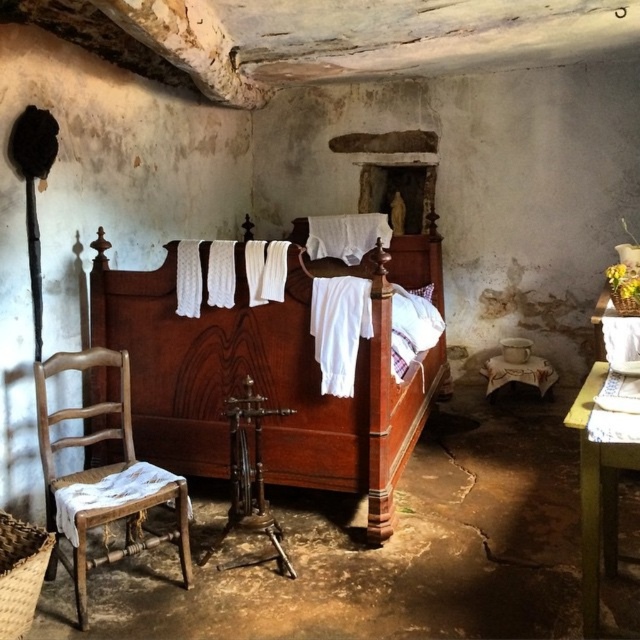
Question: Is worn wood chair at left positioned before white cloth-covered stool at lower right?

Choices:
 (A) yes
 (B) no

Answer: (A)

Question: Which of the following is the closest to the observer?

Choices:
 (A) worn wood chair at left
 (B) polished wood bed at center

Answer: (A)

Question: Which point appears farthest from the camera in this image?

Choices:
 (A) (490, 376)
 (B) (145, 408)

Answer: (A)

Question: Can you confirm if worn wood chair at left is bigger than white cloth-covered stool at lower right?

Choices:
 (A) no
 (B) yes

Answer: (B)

Question: Does polished wood bed at center have a larger size compared to white cloth-covered stool at lower right?

Choices:
 (A) yes
 (B) no

Answer: (A)

Question: Which point appears farthest from the camera in this image?

Choices:
 (A) (428, 260)
 (B) (497, 362)

Answer: (B)